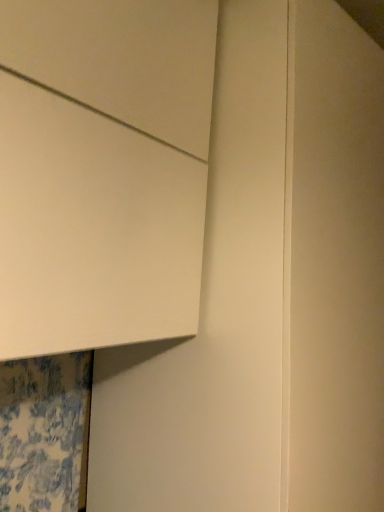
Question: In the image, is white matte cabinet at upper left on the left side or the right side of matte white door at upper left?

Choices:
 (A) right
 (B) left

Answer: (B)

Question: Which is correct: white matte cabinet at upper left is inside matte white door at upper left, or outside of it?

Choices:
 (A) inside
 (B) outside

Answer: (B)

Question: Does point (51, 294) appear closer or farther from the camera than point (231, 459)?

Choices:
 (A) farther
 (B) closer

Answer: (B)

Question: Is matte white door at upper left taller or shorter than white matte cabinet at upper left?

Choices:
 (A) tall
 (B) short

Answer: (A)

Question: Is matte white door at upper left bigger or smaller than white matte cabinet at upper left?

Choices:
 (A) small
 (B) big

Answer: (B)

Question: From a real-world perspective, is matte white door at upper left physically located above or below white matte cabinet at upper left?

Choices:
 (A) above
 (B) below

Answer: (B)

Question: Relative to white matte cabinet at upper left, is matte white door at upper left in front or behind?

Choices:
 (A) front
 (B) behind

Answer: (B)